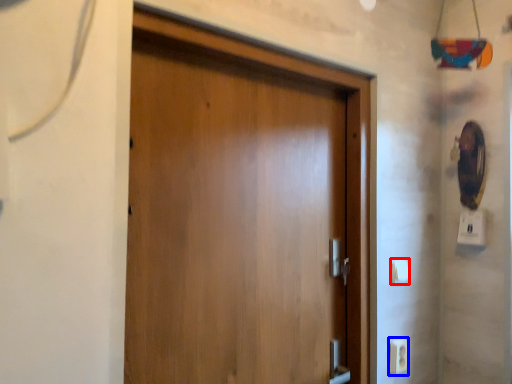
Question: Which of the following is the farthest to the observer, light switch (highlighted by a red box) or electric outlet (highlighted by a blue box)?

Choices:
 (A) light switch
 (B) electric outlet

Answer: (A)